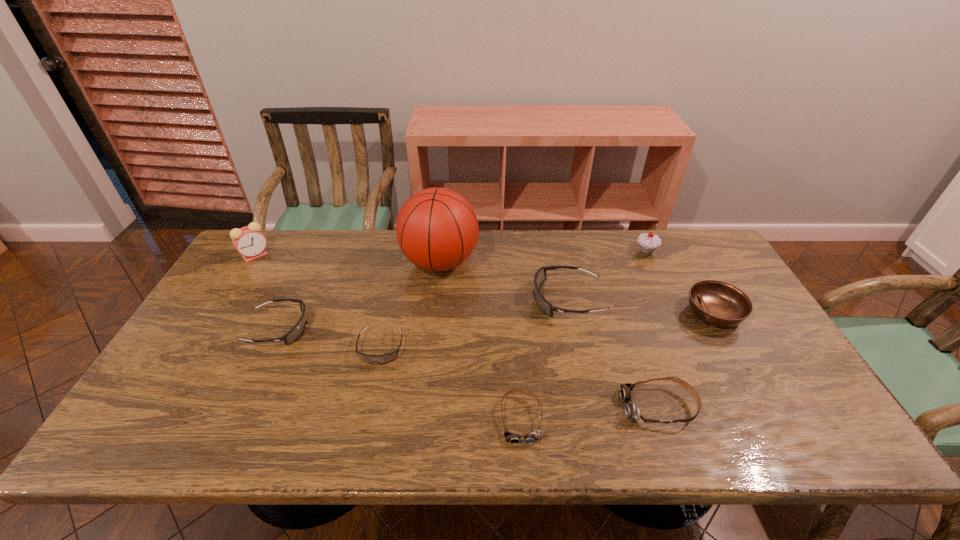
This screenshot has width=960, height=540. I want to click on free spot between the soup bowl and the gray cupcake, so click(681, 282).

Locate an element on the screen. The width and height of the screenshot is (960, 540). free space that is in between the bigger brown goggles and the tallest object is located at coordinates (549, 335).

Where is `empty space between the basketball and the eighth object from right to left`? Image resolution: width=960 pixels, height=540 pixels. empty space between the basketball and the eighth object from right to left is located at coordinates (359, 295).

This screenshot has height=540, width=960. Identify the location of vacant area between the smaller brown goggles and the smallest black goggles. (450, 383).

Identify the location of vacant space that's between the sixth shortest object and the cupcake. This screenshot has height=540, width=960. (607, 275).

The image size is (960, 540). In order to click on empty location between the tallest goggles and the right brown goggles in this screenshot , I will do `click(613, 353)`.

Locate an element on the screen. The image size is (960, 540). vacant space that is in between the second biggest black goggles and the pink alarm clock is located at coordinates (267, 292).

In order to click on object identified as the closest to the smaller brown goggles in this screenshot , I will do `click(632, 412)`.

At what (x,y) coordinates should I click in order to perform the action: click on object identified as the seventh closest to the smallest black goggles. Please return your answer as a coordinate pair (x, y). This screenshot has height=540, width=960. Looking at the image, I should click on (648, 242).

At what (x,y) coordinates should I click in order to perform the action: click on the closest goggles relative to the leftmost black goggles. Please return your answer as a coordinate pair (x, y). Image resolution: width=960 pixels, height=540 pixels. Looking at the image, I should click on (388, 357).